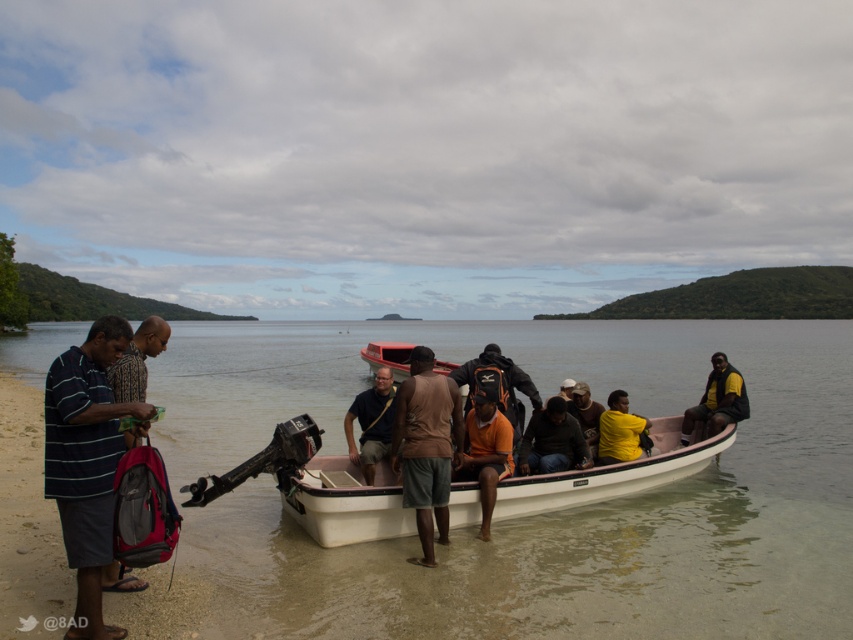
Can you confirm if clear water at boat center is shorter than yellow matte shirt at center?

In fact, clear water at boat center may be taller than yellow matte shirt at center.

You are a GUI agent. You are given a task and a screenshot of the screen. Output one action in this format:
    pyautogui.click(x=<x>, y=<y>)
    Task: Click on the clear water at boat center
    
    Given the screenshot: What is the action you would take?
    pyautogui.click(x=540, y=515)

Which is behind, point (663, 468) or point (489, 426)?

Point (663, 468)

Is white plastic canoe at center positioned before orange matte shirt at center?

That is False.

Where is `white plastic canoe at center`? The height and width of the screenshot is (640, 853). white plastic canoe at center is located at coordinates (611, 474).

Between dark brown leather jacket at center and dark gray backpack at center, which one is positioned higher?

dark gray backpack at center is higher up.

Is dark brown leather jacket at center positioned before dark gray backpack at center?

Yes, dark brown leather jacket at center is closer to the viewer.

Where is `dark brown leather jacket at center`? dark brown leather jacket at center is located at coordinates (552, 442).